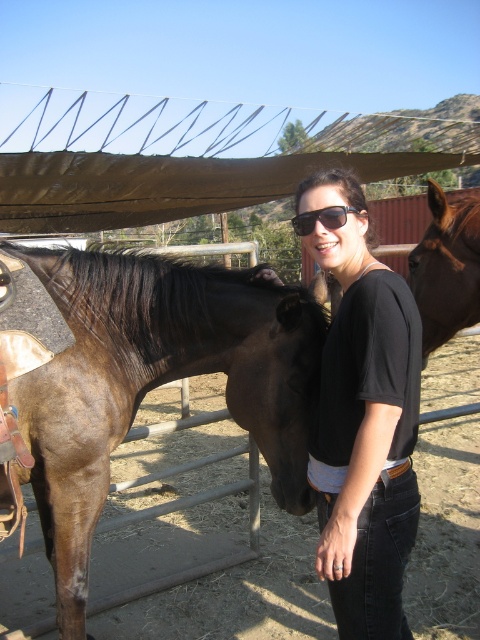
Question: Estimate the real-world distances between objects in this image. Which object is farther from the black cotton shirt at center?

Choices:
 (A) black plastic sunglasses at center
 (B) brown glossy horse at left

Answer: (A)

Question: Is brown glossy horse at left behind black plastic sunglasses at center?

Choices:
 (A) no
 (B) yes

Answer: (B)

Question: Can you confirm if black cotton shirt at center is positioned to the right of brown glossy horse at right?

Choices:
 (A) no
 (B) yes

Answer: (A)

Question: Is black cotton shirt at center smaller than brown glossy horse at right?

Choices:
 (A) no
 (B) yes

Answer: (B)

Question: Which of these objects is positioned farthest from the black plastic sunglasses at center?

Choices:
 (A) brown glossy horse at left
 (B) brown glossy horse at right

Answer: (A)

Question: Which point appears farthest from the camera in this image?

Choices:
 (A) (434, 310)
 (B) (298, 228)
 (C) (338, 579)
 (D) (268, 412)

Answer: (A)